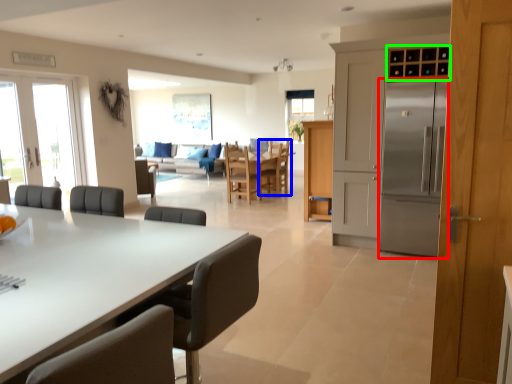
Question: Which is nearer to the refrigerator (highlighted by a red box)? chair (highlighted by a blue box) or cabinetry (highlighted by a green box).

Choices:
 (A) chair
 (B) cabinetry

Answer: (B)